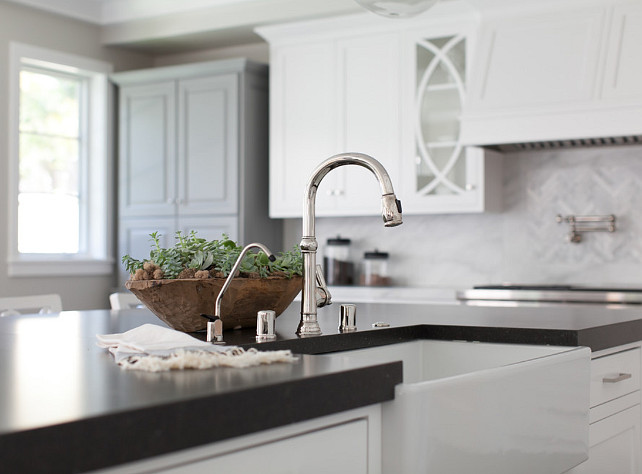
At what (x,y) coordinates should I click in order to perform the action: click on window. Please return your answer as a coordinate pair (x, y). The height and width of the screenshot is (474, 642). Looking at the image, I should click on (42, 197), (51, 102).